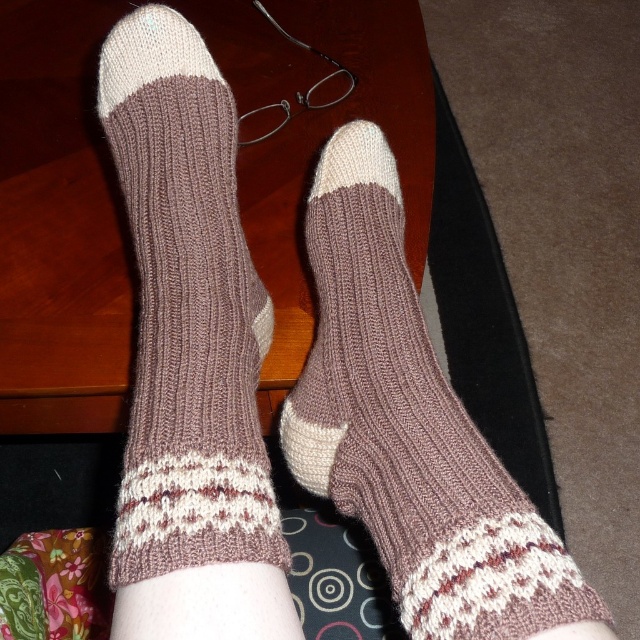
Does brown knitted sock at center come behind knit brown socks at center?

No.

At what (x,y) coordinates should I click in order to perform the action: click on brown knitted sock at center. Please return your answer as a coordinate pair (x, y). Image resolution: width=640 pixels, height=640 pixels. Looking at the image, I should click on (412, 432).

Find the location of `brown knitted sock at center`. brown knitted sock at center is located at coordinates (412, 432).